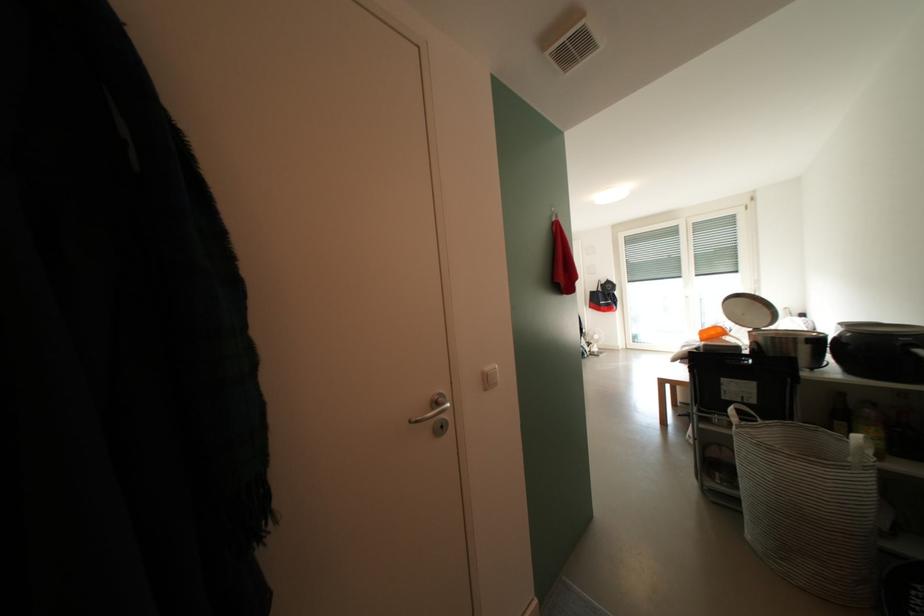
At what (x,y) coordinates should I click in order to perform the action: click on silver door handle. Please return your answer as a coordinate pair (x, y). The width and height of the screenshot is (924, 616). Looking at the image, I should click on (434, 414).